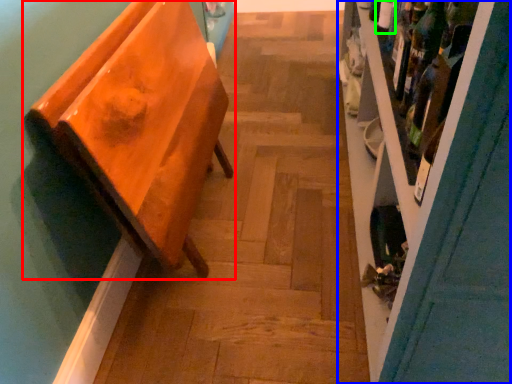
Question: Which is nearer to the furniture (highlighted by a red box)? shelf (highlighted by a blue box) or bottle (highlighted by a green box).

Choices:
 (A) shelf
 (B) bottle

Answer: (A)